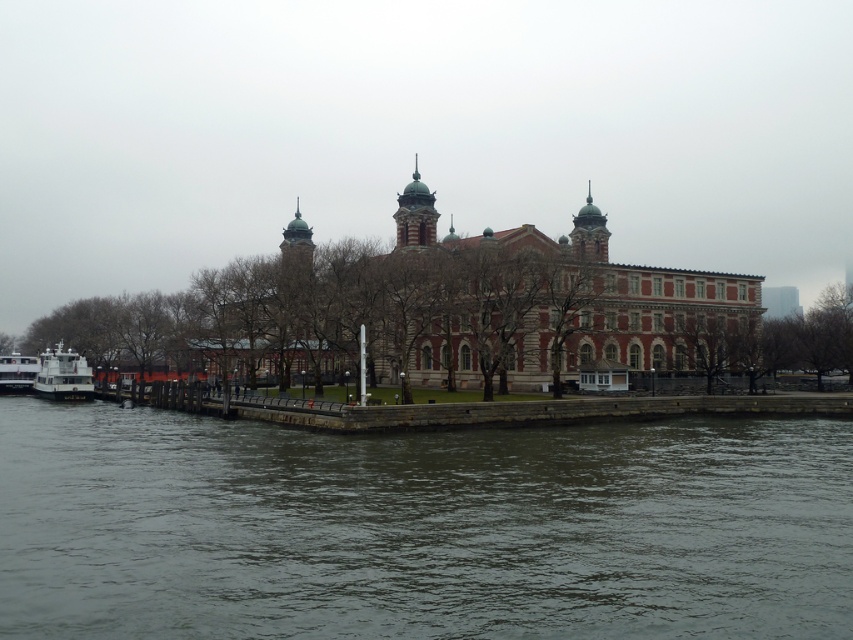
You are standing on the grassy area in front of the historic building and want to take a photo of the green stone tower at center. However, there is a white glossy ferry at lower left in the way. Can you move to the right side of the ferry to get an unobstructed view of the tower?

The white glossy ferry at lower left is below the green stone tower at center, so moving to the right side of the ferry would allow you to see the tower above it without obstruction.

You are standing on the grassy area in front of the historic building and see the white glossy ferry at lower left and the white glossy boat at lower left. Which one is closer to the water?

The white glossy ferry at lower left is positioned over the white glossy boat at lower left, meaning it is closer to the water than the boat.

You are a delivery person needing to park a 2.5 meter wide truck. You see the smooth concrete dock at lower center and the green stone tower at center. Which location can accommodate your truck?

The smooth concrete dock at lower center can accommodate the truck since its width is larger than the green stone tower at center.